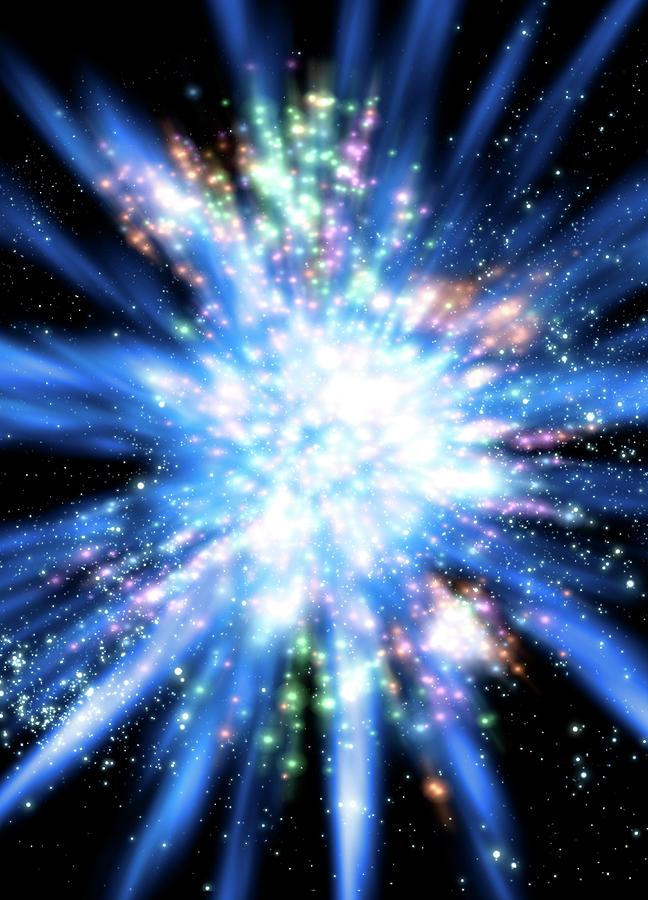
This screenshot has width=648, height=900. In order to click on purple light in this screenshot , I will do point(56,578).